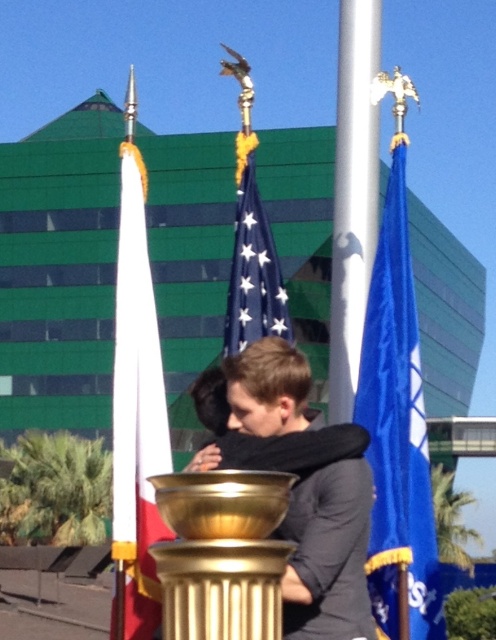
Does dark gray sweater at center have a larger size compared to white fabric flag at left?

Actually, dark gray sweater at center might be smaller than white fabric flag at left.

What do you see at coordinates (302, 486) in the screenshot? I see `dark gray sweater at center` at bounding box center [302, 486].

Identify the location of dark gray sweater at center. This screenshot has height=640, width=496. (302, 486).

From the picture: Is blue fabric flag at right in front of white fabric flag at left?

No.

Between blue fabric flag at right and white fabric flag at left, which one is positioned lower?

Positioned lower is white fabric flag at left.

Image resolution: width=496 pixels, height=640 pixels. Identify the location of blue fabric flag at right. (397, 433).

Where is `blue fabric flag at right`? This screenshot has width=496, height=640. blue fabric flag at right is located at coordinates (397, 433).

Is blue fabric flag at right behind blue fabric flag at center?

No.

Is blue fabric flag at right wider than blue fabric flag at center?

Yes, blue fabric flag at right is wider than blue fabric flag at center.

Where is `blue fabric flag at right`? The image size is (496, 640). blue fabric flag at right is located at coordinates [397, 433].